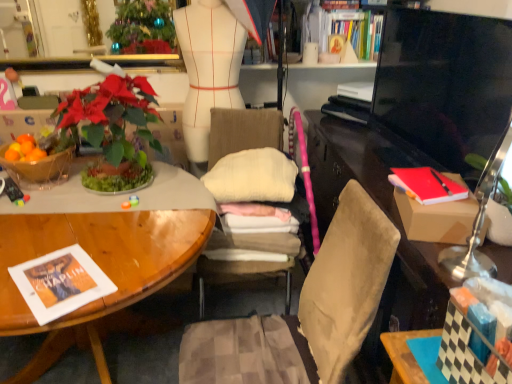
Question: Considering the relative positions of metallic gold mirror at upper center and black glossy television at right in the image provided, is metallic gold mirror at upper center to the left or to the right of black glossy television at right?

Choices:
 (A) left
 (B) right

Answer: (A)

Question: Considering their positions, is metallic gold mirror at upper center located in front of or behind black glossy television at right?

Choices:
 (A) front
 (B) behind

Answer: (B)

Question: Which object is positioned farthest from the beige fabric chair at center?

Choices:
 (A) black glossy television at right
 (B) hardcover book at upper center, the second book in the bottom-to-top sequence
 (C) translucent glass bowl at left
 (D) red matte book at right
 (E) hardcover book at upper center, marked as the 1th book in a top-to-bottom arrangement

Answer: (D)

Question: Estimate the real-world distances between objects in this image. Which object is closer to the metallic gold mirror at upper center?

Choices:
 (A) white matte mannequin at center
 (B) hardcover book at upper center, which appears as the second book when viewed from the top
 (C) black glossy television at right
 (D) red matte book at right
 (E) green leafy plant at left

Answer: (A)